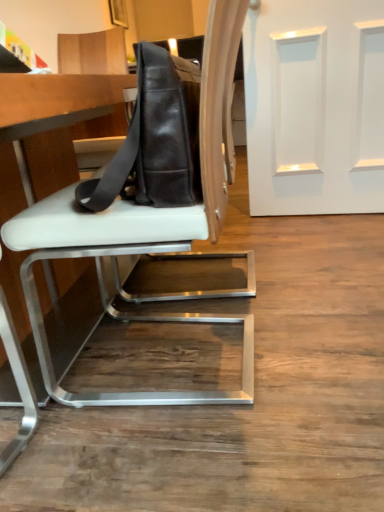
What is the approximate width of white leather table at center?

It is 1.60 meters.

Image resolution: width=384 pixels, height=512 pixels. Describe the element at coordinates (155, 139) in the screenshot. I see `black leather messenger bag at center` at that location.

From the picture: What is the approximate height of white leather chair at center?

The height of white leather chair at center is 93.30 centimeters.

At what (x,y) coordinates should I click in order to perform the action: click on white leather table at center. Please return your answer as a coordinate pair (x, y). Looking at the image, I should click on (55, 106).

Can you confirm if white smooth door at upper right is thinner than white leather table at center?

Correct, the width of white smooth door at upper right is less than that of white leather table at center.

Does white smooth door at upper right have a greater height compared to white leather table at center?

Yes, white smooth door at upper right is taller than white leather table at center.

Locate an element on the screen. door on the right of white leather table at center is located at coordinates (315, 106).

Would you say white smooth door at upper right is to the left or to the right of white leather table at center in the picture?

white smooth door at upper right is positioned on white leather table at center's right side.

Which is more to the right, white leather table at center or white smooth door at upper right?

From the viewer's perspective, white smooth door at upper right appears more on the right side.

From a real-world perspective, does white leather table at center stand above white smooth door at upper right?

No, from a real-world perspective, white leather table at center is not above white smooth door at upper right.

Could you tell me if white leather table at center is turned towards white smooth door at upper right?

Result: No, white leather table at center is not turned towards white smooth door at upper right.

Does white leather table at center contain white smooth door at upper right?

Actually, white smooth door at upper right is outside white leather table at center.

Where is `messenger bag above the white leather chair at center (from the image's perspective)`? The height and width of the screenshot is (512, 384). messenger bag above the white leather chair at center (from the image's perspective) is located at coordinates (155, 139).

Considering the relative positions of white leather chair at center and black leather messenger bag at center in the image provided, is white leather chair at center to the left or to the right of black leather messenger bag at center?

white leather chair at center is positioned on black leather messenger bag at center's right side.

Which object is further away from the camera taking this photo, white leather chair at center or black leather messenger bag at center?

black leather messenger bag at center is further away from the camera.

Would you say white smooth door at upper right is a long distance from black leather messenger bag at center?

That's right, there is a large distance between white smooth door at upper right and black leather messenger bag at center.

Is white smooth door at upper right turned away from black leather messenger bag at center?

Yes, white smooth door at upper right's orientation is away from black leather messenger bag at center.

From the picture: Is white smooth door at upper right smaller than black leather messenger bag at center?

Actually, white smooth door at upper right might be larger than black leather messenger bag at center.

From a real-world perspective, does black leather messenger bag at center sit lower than white smooth door at upper right?

Actually, black leather messenger bag at center is physically above white smooth door at upper right in the real world.

How much distance is there between black leather messenger bag at center and white smooth door at upper right?

black leather messenger bag at center and white smooth door at upper right are 1.42 meters apart.

How different are the orientations of black leather messenger bag at center and white smooth door at upper right in degrees?

The angular difference between black leather messenger bag at center and white smooth door at upper right is 93.6 degrees.

Is black leather messenger bag at center in contact with white smooth door at upper right?

No, black leather messenger bag at center is not making contact with white smooth door at upper right.

From the picture: How different are the orientations of white leather table at center and white leather chair at center in degrees?

90.7 degrees.

From a real-world perspective, is white leather table at center on top of white leather chair at center?

No, from a real-world perspective, white leather table at center is not on top of white leather chair at center.

Is point (100, 104) behind point (34, 241)?

That is False.

Is white leather chair at center next to white leather table at center?

They are not placed beside each other.

Is point (5, 223) closer or farther from the camera than point (21, 133)?

Point (5, 223).

Considering the relative sizes of white leather chair at center and white leather table at center in the image provided, is white leather chair at center wider than white leather table at center?

In fact, white leather chair at center might be narrower than white leather table at center.

Identify the location of chair lying behind the white leather table at center. The height and width of the screenshot is (512, 384). (147, 228).

Find the location of a particular element. The image size is (384, 512). table below the white smooth door at upper right (from the image's perspective) is located at coordinates (55, 106).

Find the location of a particular element. door above the white leather table at center (from the image's perspective) is located at coordinates (315, 106).

Estimate the real-world distances between objects in this image. Which object is further from white smooth door at upper right, white leather table at center or black leather messenger bag at center?

The object further to white smooth door at upper right is black leather messenger bag at center.

When comparing their distances from black leather messenger bag at center, does white smooth door at upper right or white leather chair at center seem closer?

Based on the image, white leather chair at center appears to be nearer to black leather messenger bag at center.

From the image, which object appears to be nearer to white leather chair at center, white leather table at center or black leather messenger bag at center?

black leather messenger bag at center lies closer to white leather chair at center than the other object.

Estimate the real-world distances between objects in this image. Which object is further from black leather messenger bag at center, white leather table at center or white leather chair at center?

The object further to black leather messenger bag at center is white leather chair at center.

From the image, which object appears to be nearer to black leather messenger bag at center, white leather chair at center or white smooth door at upper right?

Among the two, white leather chair at center is located nearer to black leather messenger bag at center.

Based on their spatial positions, is black leather messenger bag at center or white leather chair at center closer to white leather table at center?

The object closer to white leather table at center is black leather messenger bag at center.

Estimate the real-world distances between objects in this image. Which object is closer to white smooth door at upper right, black leather messenger bag at center or white leather chair at center?

The object closer to white smooth door at upper right is white leather chair at center.

Estimate the real-world distances between objects in this image. Which object is closer to white leather chair at center, white smooth door at upper right or black leather messenger bag at center?

black leather messenger bag at center lies closer to white leather chair at center than the other object.

This screenshot has height=512, width=384. Find the location of `chair between white leather table at center and white smooth door at upper right in the front-back direction`. chair between white leather table at center and white smooth door at upper right in the front-back direction is located at coordinates (147, 228).

The height and width of the screenshot is (512, 384). Find the location of `messenger bag between white leather table at center and white smooth door at upper right from front to back`. messenger bag between white leather table at center and white smooth door at upper right from front to back is located at coordinates (155, 139).

In order to click on messenger bag situated between white leather table at center and white leather chair at center from left to right in this screenshot , I will do `click(155, 139)`.

The height and width of the screenshot is (512, 384). I want to click on messenger bag located between white leather chair at center and white smooth door at upper right in the depth direction, so click(x=155, y=139).